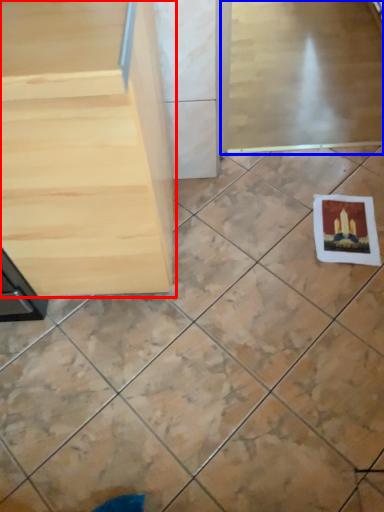
Question: Among these objects, which one is nearest to the camera, furniture (highlighted by a red box) or screen door (highlighted by a blue box)?

Choices:
 (A) furniture
 (B) screen door

Answer: (A)